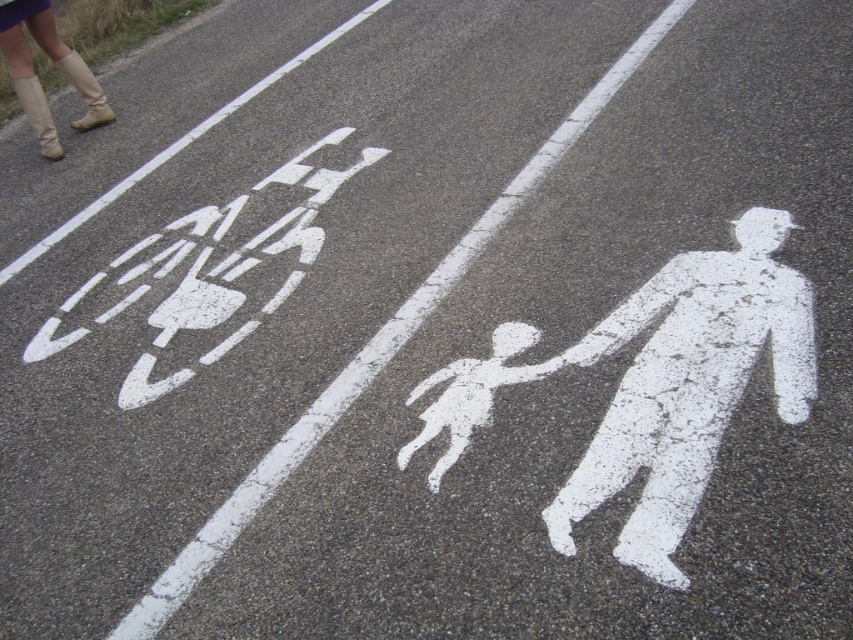
Which of these two, white chalk figure at center or beige leather boots at upper left, stands shorter?

Standing shorter between the two is white chalk figure at center.

Measure the distance between point (456, 381) and camera.

2.80 meters

You are a GUI agent. You are given a task and a screenshot of the screen. Output one action in this format:
    pyautogui.click(x=<x>, y=<y>)
    Task: Click on the white chalk figure at center
    The width and height of the screenshot is (853, 640).
    Given the screenshot: What is the action you would take?
    pyautogui.click(x=469, y=394)

Find the location of a particular element. The image size is (853, 640). white matte pedestrian at center is located at coordinates (688, 385).

Is white matte pedestrian at center thinner than beige leather boots at upper left?

Incorrect, white matte pedestrian at center's width is not less than beige leather boots at upper left's.

You are a GUI agent. You are given a task and a screenshot of the screen. Output one action in this format:
    pyautogui.click(x=<x>, y=<y>)
    Task: Click on the white matte pedestrian at center
    
    Given the screenshot: What is the action you would take?
    pyautogui.click(x=688, y=385)

Who is positioned more to the right, white matte pedestrian at center or white chalk figure at center?

white matte pedestrian at center

Does white matte pedestrian at center appear on the left side of white chalk figure at center?

Incorrect, white matte pedestrian at center is not on the left side of white chalk figure at center.

Is point (669, 522) positioned in front of point (554, 369)?

Yes, point (669, 522) is in front of point (554, 369).

The width and height of the screenshot is (853, 640). I want to click on white matte pedestrian at center, so click(688, 385).